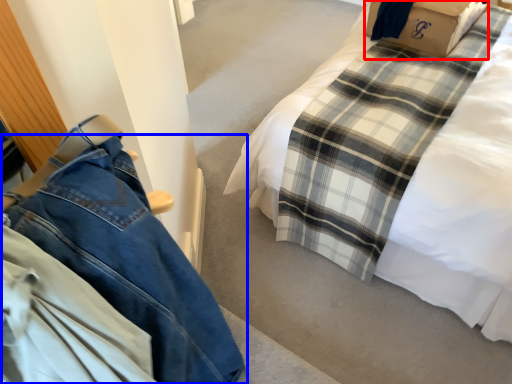
Question: Which point is closer to the camera, cardboard box (highlighted by a red box) or trousers (highlighted by a blue box)?

Choices:
 (A) cardboard box
 (B) trousers

Answer: (B)